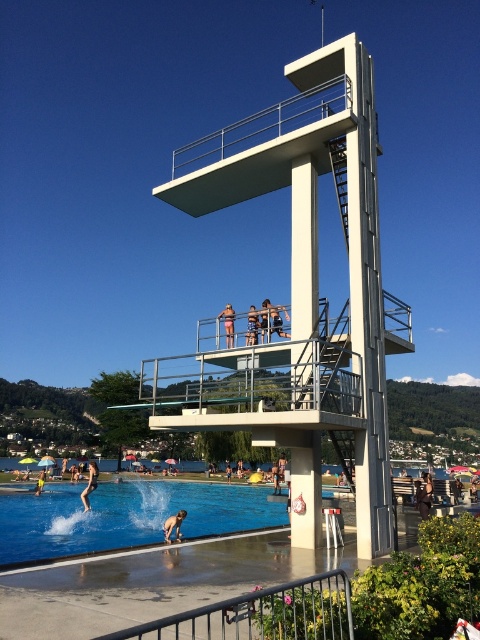
What is the position of the tan skin person at center relative to the dark blue swimsuit at center in the diving platform scene?

The tan skin person at center is positioned to the left of the dark blue swimsuit at center.

You are standing at the diving platform and want to reach the point marked at coordinates point (405, 304). If your maximum reach distance is 90 feet, can you comfortably reach that point?

The distance between you and point (405, 304) is 95.40 feet, which exceeds your maximum reach of 90 feet. Therefore, you cannot comfortably reach that point.